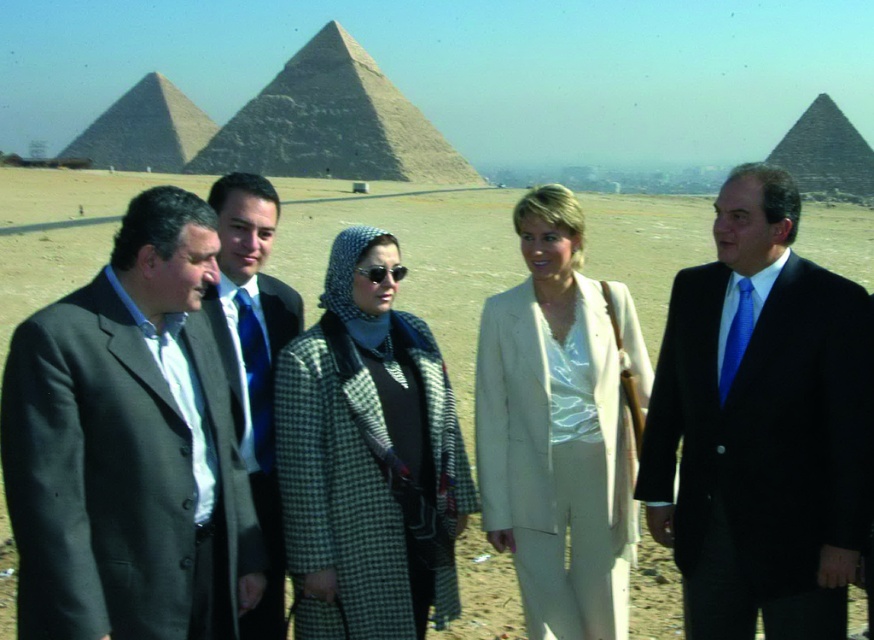
Which is behind, point (175, 442) or point (365, 589)?

Point (365, 589)

Describe the element at coordinates (128, 445) in the screenshot. I see `dark gray suit at left` at that location.

Where is `dark gray suit at left`? dark gray suit at left is located at coordinates (128, 445).

How distant is beige fabric suit at center from blue silk tie at center?

beige fabric suit at center and blue silk tie at center are 22.61 meters apart from each other.

Which is below, beige fabric suit at center or blue silk tie at center?

→ Positioned lower is beige fabric suit at center.

You are a GUI agent. You are given a task and a screenshot of the screen. Output one action in this format:
    pyautogui.click(x=<x>, y=<y>)
    Task: Click on the beige fabric suit at center
    The image size is (874, 640).
    Given the screenshot: What is the action you would take?
    pyautogui.click(x=560, y=428)

I want to click on beige fabric suit at center, so click(x=560, y=428).

Identify the location of matte black suit at center. The image size is (874, 640). (760, 426).

From the picture: Who is more forward, (750,524) or (403,164)?

Point (750,524) is in front.

Measure the distance between matte black suit at center and camera.

matte black suit at center is 75.93 meters from camera.

Image resolution: width=874 pixels, height=640 pixels. I want to click on matte black suit at center, so click(760, 426).